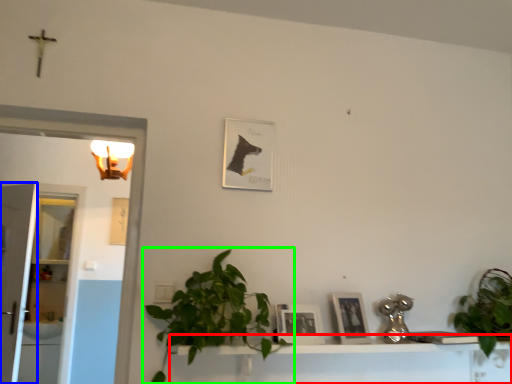
Question: Based on their relative distances, which object is nearer to vanity (highlighted by a red box)? Choose from glass door (highlighted by a blue box) and houseplant (highlighted by a green box).

Choices:
 (A) glass door
 (B) houseplant

Answer: (B)